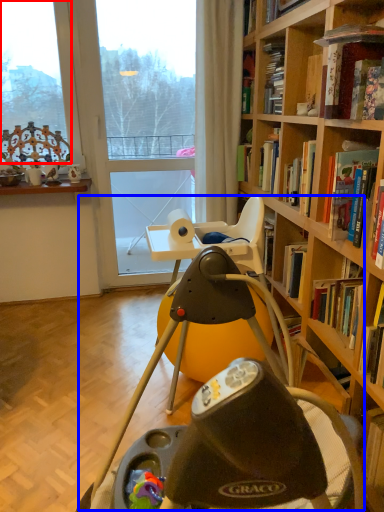
Question: Which object is closer to the camera taking this photo, window (highlighted by a red box) or swivel chair (highlighted by a blue box)?

Choices:
 (A) window
 (B) swivel chair

Answer: (B)